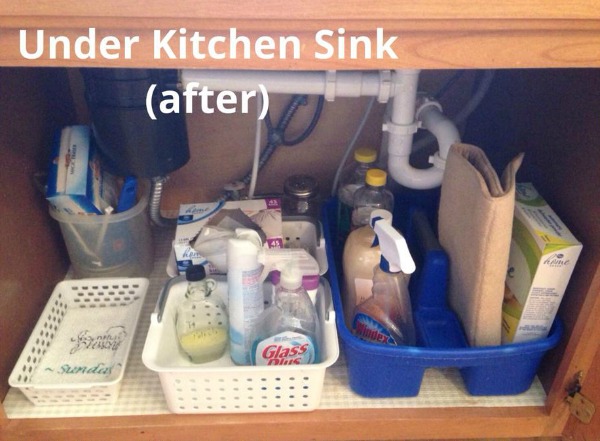
Find the location of a particular element. drawer liner is located at coordinates (338, 401).